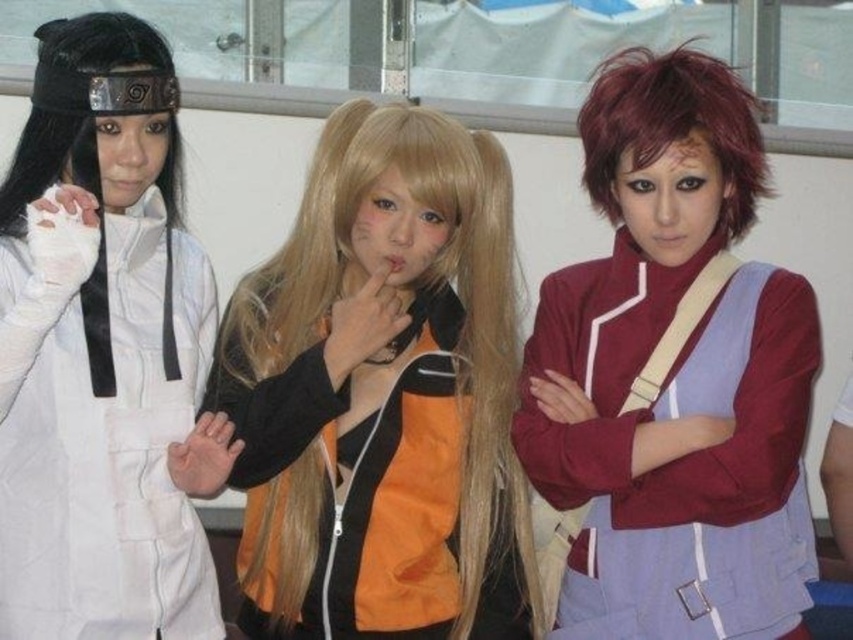
Which object is at the coordinates point (100, 435)?

The white matte glove at left is located at point (100, 435).

You are standing at the center of the room and see two points marked in the image. Which point, point (242,630) or point (576,593), is closer to you?

Point (576,593) is closer to you because it is in front of point (242,630).

You are a photographer at the event and want to capture a photo where the shiny orange jacket at center and the white matte glove at left are both visible. Based on their positions, which object should you ensure is closer to the left side of the frame?

The white matte glove at left should be positioned closer to the left side of the frame since it is located to the left of the shiny orange jacket at center.